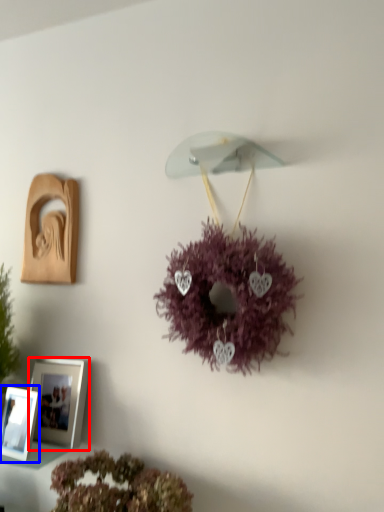
Question: Which point is closer to the camera, picture frame (highlighted by a red box) or picture frame (highlighted by a blue box)?

Choices:
 (A) picture frame
 (B) picture frame

Answer: (B)